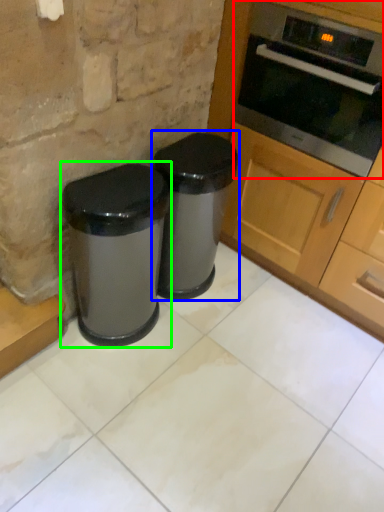
Question: Which object is positioned farthest from oven (highlighted by a red box)? Select from waste container (highlighted by a blue box) and waste container (highlighted by a green box).

Choices:
 (A) waste container
 (B) waste container

Answer: (B)